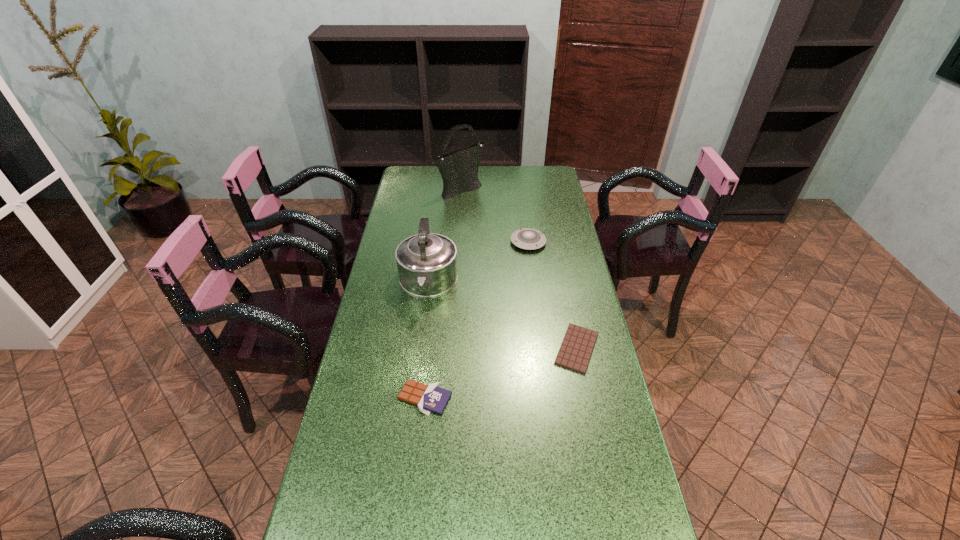
The height and width of the screenshot is (540, 960). What are the coordinates of `the tallest object` in the screenshot? It's located at (459, 169).

Find the location of a particular element. The height and width of the screenshot is (540, 960). shoulder bag is located at coordinates (459, 169).

Where is `the fourth shortest object`? The height and width of the screenshot is (540, 960). the fourth shortest object is located at coordinates (427, 263).

Locate an element on the screen. The image size is (960, 540). the third nearest object is located at coordinates (427, 263).

Identify the location of the fourth nearest object. Image resolution: width=960 pixels, height=540 pixels. (530, 239).

At what (x,y) coordinates should I click in order to perform the action: click on saucer. Please return your answer as a coordinate pair (x, y). Looking at the image, I should click on (530, 239).

The height and width of the screenshot is (540, 960). Find the location of `the left chocolate bar`. the left chocolate bar is located at coordinates (429, 398).

Find the location of a particular element. This screenshot has height=540, width=960. the second shortest object is located at coordinates (429, 398).

The image size is (960, 540). Identify the location of the shortest object. pyautogui.click(x=574, y=354).

The height and width of the screenshot is (540, 960). What are the coordinates of `the shorter chocolate bar` in the screenshot? It's located at (574, 354).